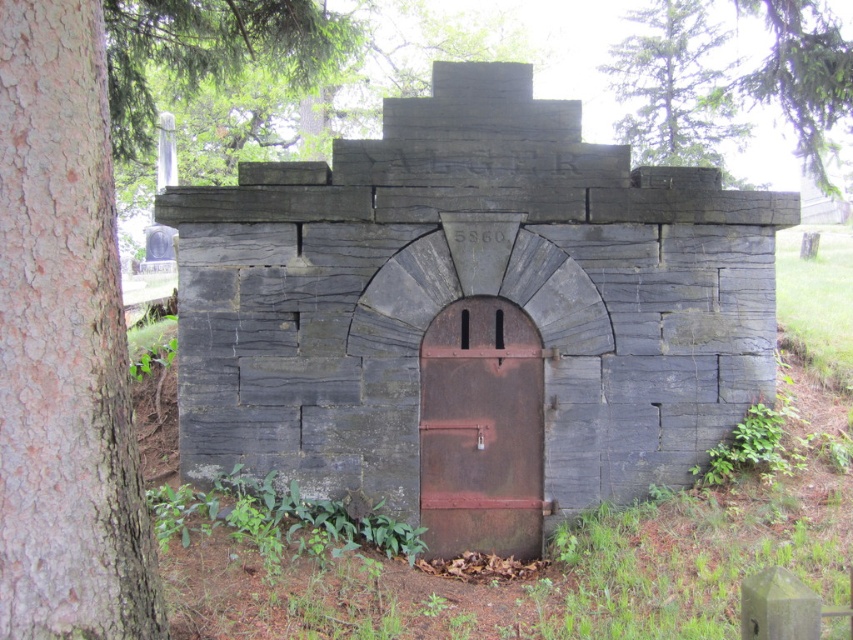
Is rusty metal door at center to the left of green leafy tree at upper right from the viewer's perspective?

Correct, you'll find rusty metal door at center to the left of green leafy tree at upper right.

Is rusty metal door at center to the right of green leafy tree at upper right from the viewer's perspective?

No, rusty metal door at center is not to the right of green leafy tree at upper right.

From the picture: Who is more forward, (450, 454) or (828, 186)?

Point (450, 454)

The image size is (853, 640). I want to click on rusty metal door at center, so click(480, 429).

Between green leafy tree at upper center and green leafy tree at upper right, which one has more height?

green leafy tree at upper center

Does green leafy tree at upper center have a lesser height compared to green leafy tree at upper right?

In fact, green leafy tree at upper center may be taller than green leafy tree at upper right.

The width and height of the screenshot is (853, 640). What do you see at coordinates (672, 86) in the screenshot?
I see `green leafy tree at upper center` at bounding box center [672, 86].

Find the location of a particular element. The image size is (853, 640). green leafy tree at upper center is located at coordinates (672, 86).

Does rusty metal door at center appear on the right side of green leafy tree at upper center?

In fact, rusty metal door at center is to the left of green leafy tree at upper center.

Is point (469, 440) positioned before point (729, 120)?

Yes.

Is point (421, 508) behind point (635, 65)?

No.

Where is `rusty metal door at center`? The image size is (853, 640). rusty metal door at center is located at coordinates (480, 429).